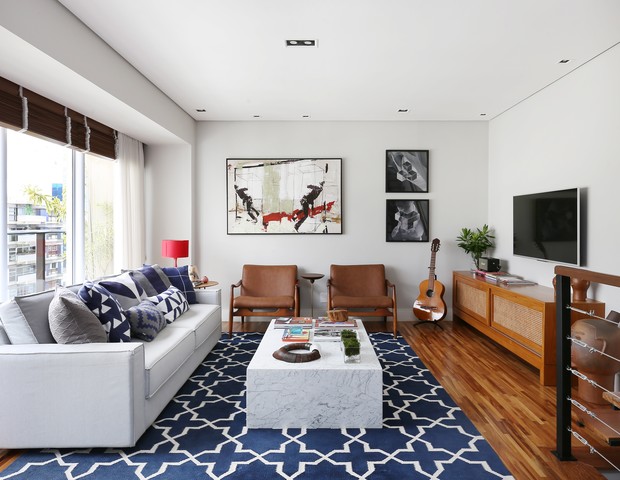
The height and width of the screenshot is (480, 620). I want to click on floor, so click(x=428, y=463).